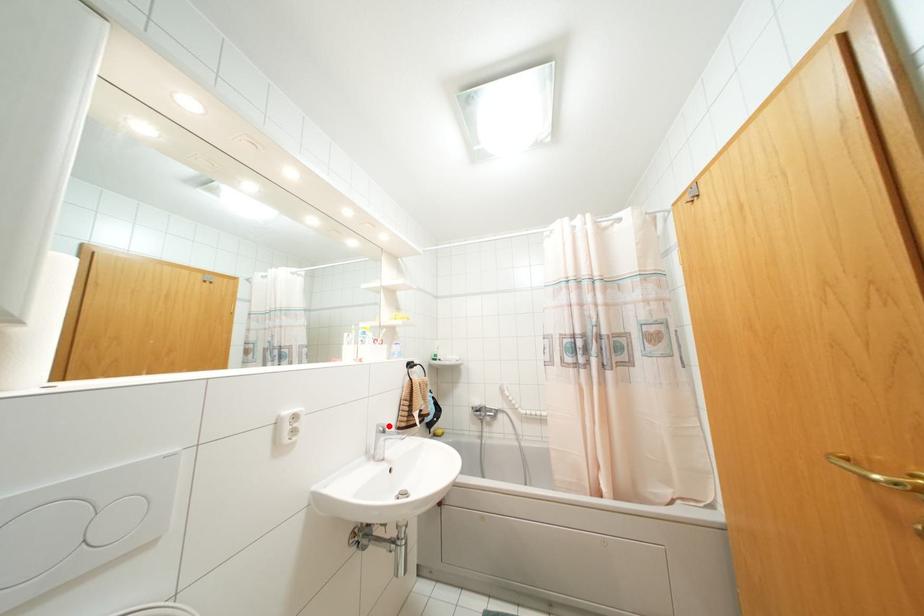
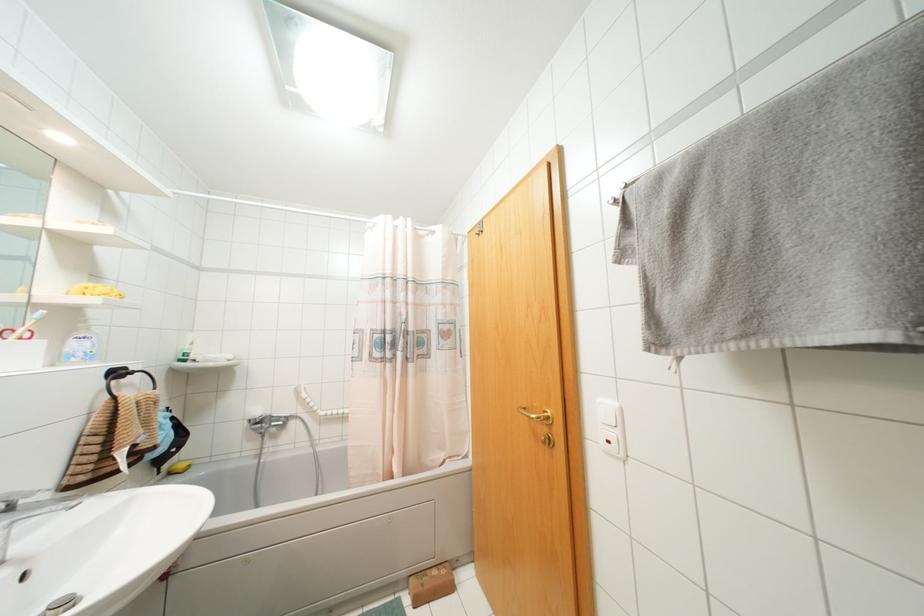
The point at the highlighted location is marked in the first image. Where is the corresponding point in the second image?

(30, 493)